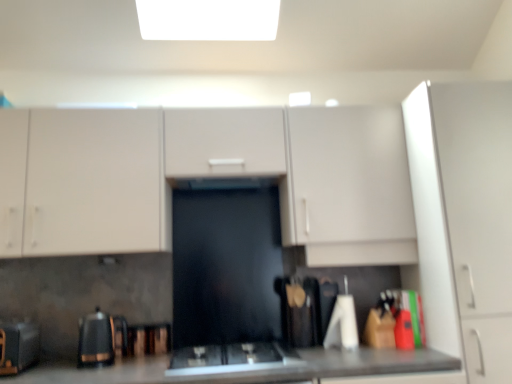
Question: From the image's perspective, is black glass gas stove at center located beneath wooden spatula at center, which ranks as the 1th appliance in right-to-left order?

Choices:
 (A) no
 (B) yes

Answer: (B)

Question: From a real-world perspective, is black glass gas stove at center positioned over wooden spatula at center, the 3th appliance from the left, based on gravity?

Choices:
 (A) yes
 (B) no

Answer: (B)

Question: From the image's perspective, is black glass gas stove at center on top of wooden spatula at center, the 3th appliance from the left?

Choices:
 (A) yes
 (B) no

Answer: (B)

Question: Can you confirm if black glass gas stove at center is taller than wooden spatula at center, which ranks as the 1th appliance in right-to-left order?

Choices:
 (A) no
 (B) yes

Answer: (A)

Question: Does black glass gas stove at center come behind wooden spatula at center, the 3th appliance from the left?

Choices:
 (A) yes
 (B) no

Answer: (B)

Question: In the image, is white matte cabinet at right, positioned as the 1th cabinetry in right-to-left order, on the left side or the right side of black glossy kettle at lower left, the second appliance when ordered from right to left?

Choices:
 (A) left
 (B) right

Answer: (B)

Question: Considering the positions of point (437, 301) and point (78, 327), is point (437, 301) closer or farther from the camera than point (78, 327)?

Choices:
 (A) closer
 (B) farther

Answer: (A)

Question: Looking at the image, does white matte cabinet at right, positioned as the 1th cabinetry in right-to-left order, seem bigger or smaller compared to black glossy kettle at lower left, the second appliance positioned from the left?

Choices:
 (A) small
 (B) big

Answer: (B)

Question: Relative to black glossy kettle at lower left, the second appliance positioned from the left, is white matte cabinet at right, which is the second cabinetry from left to right, in front or behind?

Choices:
 (A) front
 (B) behind

Answer: (A)

Question: From the image's perspective, is matte white cabinets at center, the 2th cabinetry when ordered from right to left, above or below wooden spatula at center, which ranks as the 1th appliance in right-to-left order?

Choices:
 (A) above
 (B) below

Answer: (A)

Question: From a real-world perspective, is matte white cabinets at center, the 2th cabinetry when ordered from right to left, physically located above or below wooden spatula at center, the 3th appliance from the left?

Choices:
 (A) below
 (B) above

Answer: (B)

Question: In the image, is matte white cabinets at center, acting as the 1th cabinetry starting from the left, positioned in front of or behind wooden spatula at center, which ranks as the 1th appliance in right-to-left order?

Choices:
 (A) behind
 (B) front

Answer: (B)

Question: Do you think matte white cabinets at center, the 2th cabinetry when ordered from right to left, is within wooden spatula at center, which ranks as the 1th appliance in right-to-left order, or outside of it?

Choices:
 (A) inside
 (B) outside

Answer: (B)

Question: Which is correct: black glossy kettle at lower left, the second appliance when ordered from right to left, is inside wooden spatula at center, the 3th appliance from the left, or outside of it?

Choices:
 (A) inside
 (B) outside

Answer: (B)

Question: Based on their sizes in the image, would you say black glossy kettle at lower left, the second appliance when ordered from right to left, is bigger or smaller than wooden spatula at center, the 3th appliance from the left?

Choices:
 (A) small
 (B) big

Answer: (A)